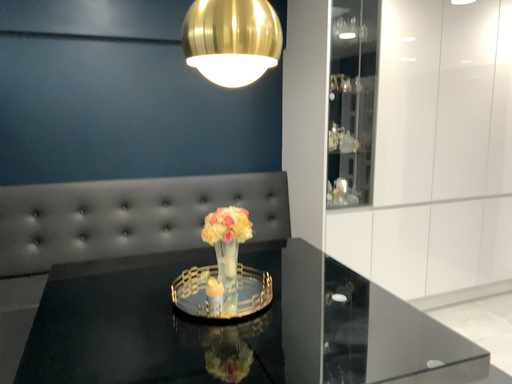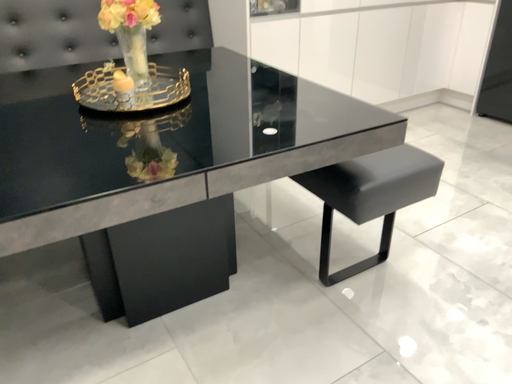
Question: How did the camera likely rotate when shooting the video?

Choices:
 (A) rotated left
 (B) rotated right

Answer: (B)